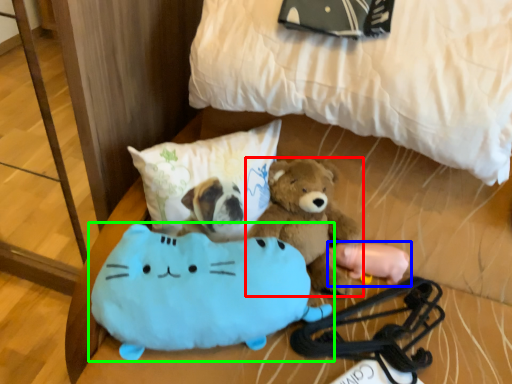
Question: Estimate the real-world distances between objects in this image. Which object is farther from teddy bear (highlighted by a red box), toy (highlighted by a blue box) or toy (highlighted by a green box)?

Choices:
 (A) toy
 (B) toy

Answer: (B)